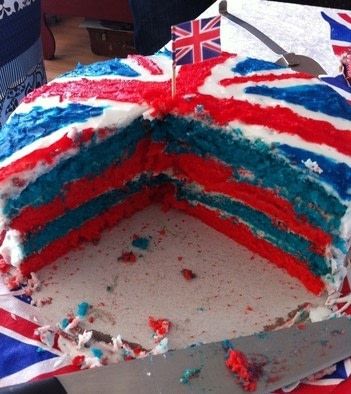
Where is `cake knife handle`? cake knife handle is located at coordinates point(24,388).